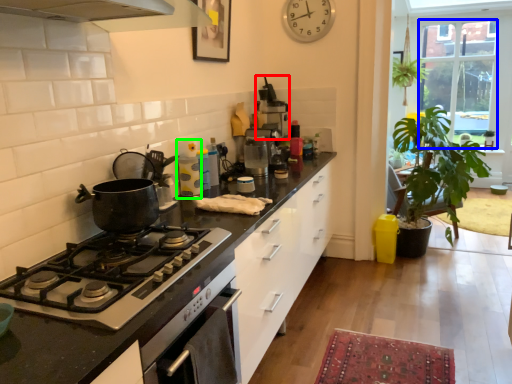
Question: Which is farther away from appliance (highlighted by a red box)? window (highlighted by a blue box) or appliance (highlighted by a green box)?

Choices:
 (A) window
 (B) appliance

Answer: (A)